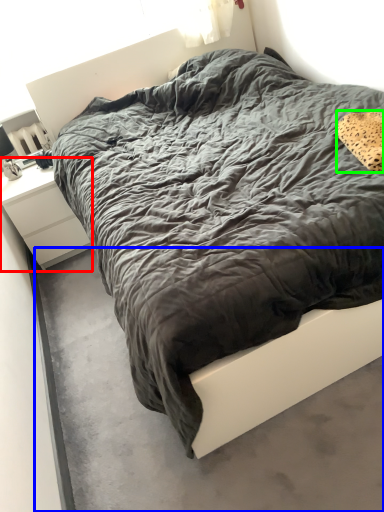
Question: Based on their relative distances, which object is farther from nightstand (highlighted by a red box)? Choose from concrete (highlighted by a blue box) and pillow (highlighted by a green box).

Choices:
 (A) concrete
 (B) pillow

Answer: (B)